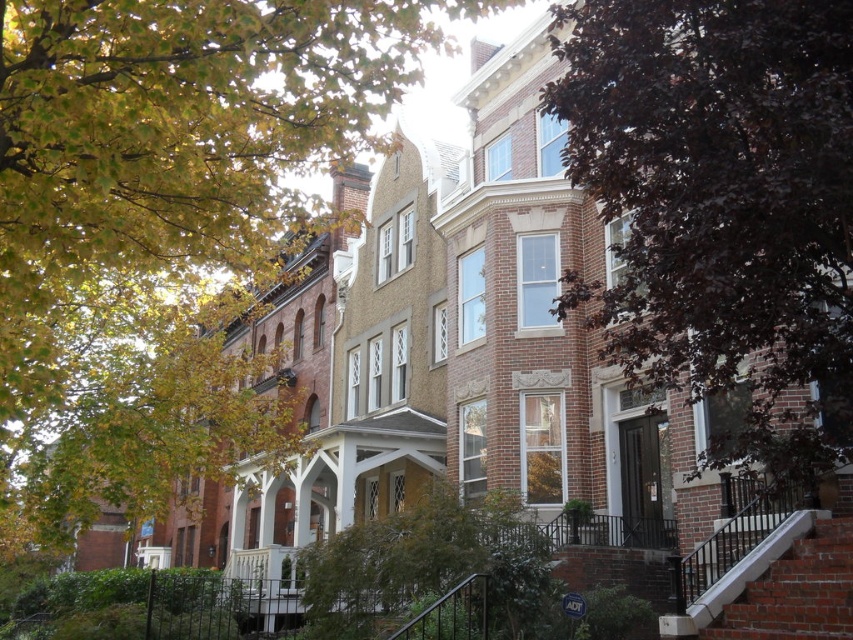
Question: Can you confirm if green leafy tree at upper left is thinner than white concrete stairs at lower right?

Choices:
 (A) no
 (B) yes

Answer: (A)

Question: Can you confirm if purple leafy tree at center is positioned to the right of white concrete stairs at lower right?

Choices:
 (A) yes
 (B) no

Answer: (B)

Question: Does green leafy tree at upper left appear under white concrete stairs at lower right?

Choices:
 (A) no
 (B) yes

Answer: (A)

Question: Among these points, which one is farthest from the camera?

Choices:
 (A) (611, 193)
 (B) (767, 593)
 (C) (317, 26)

Answer: (B)

Question: Which point is closer to the camera taking this photo?

Choices:
 (A) (749, 628)
 (B) (607, 68)
 (C) (108, 120)

Answer: (C)

Question: Which point is farther from the camera taking this photo?

Choices:
 (A) (840, 545)
 (B) (24, 19)

Answer: (A)